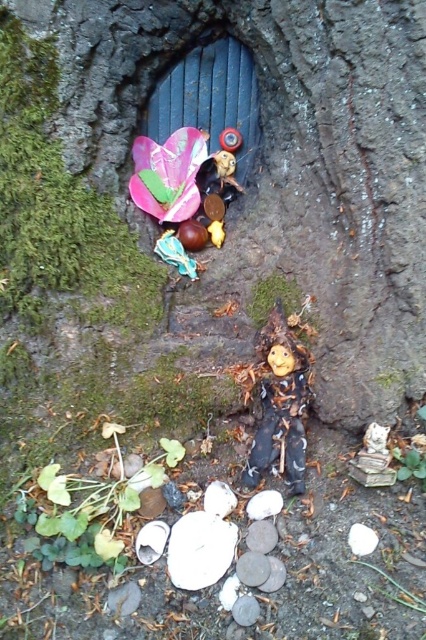
You are a tiny creature standing at the base of the miniature staircase leading to the dark blue door. You want to place a shiny plastic flower at upper left on the step closest to the door. Which direction should you move from your current position to reach that step?

The shiny plastic flower at upper left is located at point (175,173), so you should move towards the upper left direction to place it on the step closest to the door.

You are a tiny creature trying to carry both the wooden doll at center and the smooth white stone at lower center up the staircase. Which object should you pick first if you want to carry the wider one first?

You should pick the wooden doll at center first because it is wider than the smooth white stone at lower center according to the description.